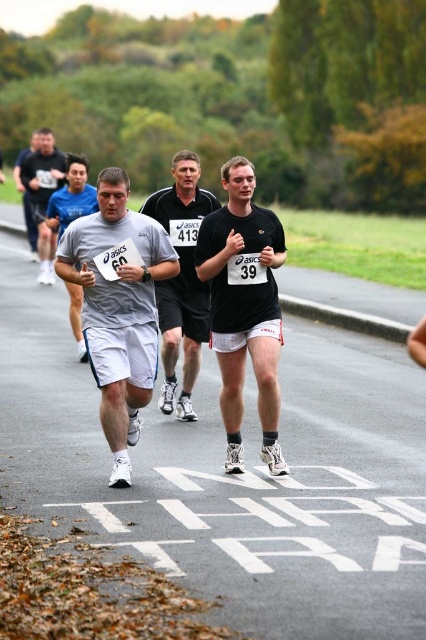
Is black matte shorts at center smaller than matte black shirt at center?

No.

Is black matte shorts at center positioned in front of matte black shirt at center?

That is True.

Does point (244, 356) come farther from viewer compared to point (192, 268)?

No, it is not.

Locate an element on the screen. This screenshot has height=640, width=426. black matte shorts at center is located at coordinates (244, 307).

Is gray fabric shorts at left to the right of black matte shorts at center from the viewer's perspective?

No, gray fabric shorts at left is not to the right of black matte shorts at center.

Which is above, gray fabric shorts at left or black matte shorts at center?

black matte shorts at center is higher up.

Who is more distant from viewer, (132, 349) or (241, 163)?

The point (241, 163) is more distant.

The width and height of the screenshot is (426, 640). I want to click on gray fabric shorts at left, so click(118, 307).

Is point (242, 385) in front of point (36, 244)?

Yes.

Find the location of `black matte shorts at center`. black matte shorts at center is located at coordinates (244, 307).